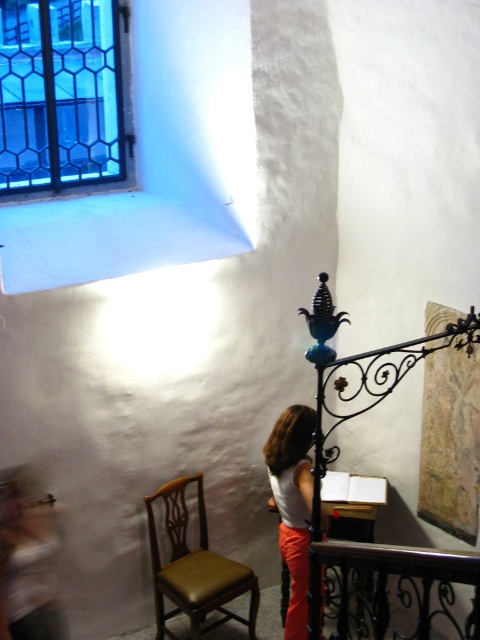
You are organizing a small event and need to place a white matte shirt at center on a brown leather chair at lower left. Will the shirt fit comfortably on the chair?

The brown leather chair at lower left has a larger size compared to white matte shirt at center, so the shirt will fit comfortably on the chair.

You are standing in the room and want to place a small plant between the two points, point (465, 570) and point (248, 566). Which point should the plant be closer to if you want it to be nearer to the camera?

The plant should be placed closer to point (465, 570) because it is closer to the camera than point (248, 566).